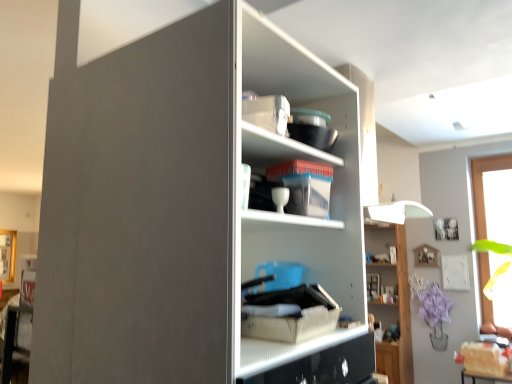
Question: Should I look upward or downward to see transparent glass window at right?

Choices:
 (A) down
 (B) up

Answer: (A)

Question: From the image's perspective, is clear plastic container at upper center, acting as the 1th shelf starting from the front, under matte gray cupboard at center?

Choices:
 (A) no
 (B) yes

Answer: (A)

Question: Is clear plastic container at upper center, which is the 2th shelf from bottom to top, thinner than matte gray cupboard at center?

Choices:
 (A) no
 (B) yes

Answer: (B)

Question: From a real-world perspective, is clear plastic container at upper center, which ranks as the 1th shelf in left-to-right order, below matte gray cupboard at center?

Choices:
 (A) no
 (B) yes

Answer: (A)

Question: Is clear plastic container at upper center, which ranks as the 1th shelf in left-to-right order, facing towards matte gray cupboard at center?

Choices:
 (A) no
 (B) yes

Answer: (B)

Question: Is clear plastic container at upper center, which appears as the 2th shelf when viewed from the right, shorter than matte gray cupboard at center?

Choices:
 (A) no
 (B) yes

Answer: (B)

Question: Is clear plastic container at upper center, the 2th shelf in the back-to-front sequence, to the right of matte gray cupboard at center from the viewer's perspective?

Choices:
 (A) no
 (B) yes

Answer: (B)

Question: Is matte white cabinet at center surrounded by transparent glass window at right?

Choices:
 (A) yes
 (B) no

Answer: (B)

Question: Is transparent glass window at right smaller than matte white cabinet at center?

Choices:
 (A) no
 (B) yes

Answer: (A)

Question: Is transparent glass window at right to the left of matte white cabinet at center from the viewer's perspective?

Choices:
 (A) yes
 (B) no

Answer: (B)

Question: Is the depth of transparent glass window at right less than that of matte white cabinet at center?

Choices:
 (A) no
 (B) yes

Answer: (B)

Question: Is transparent glass window at right positioned with its back to matte white cabinet at center?

Choices:
 (A) no
 (B) yes

Answer: (A)

Question: Are transparent glass window at right and matte white cabinet at center far apart?

Choices:
 (A) yes
 (B) no

Answer: (B)

Question: Is the position of wooden shelf at upper right, placed as the 2th shelf when sorted from top to bottom, more distant than that of matte gray cupboard at center?

Choices:
 (A) yes
 (B) no

Answer: (A)